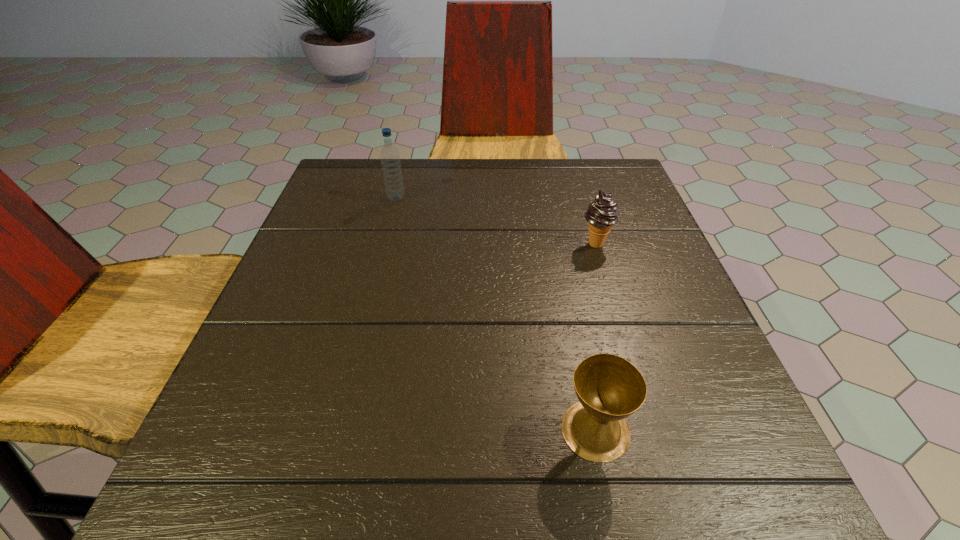
Where is `water bottle`? water bottle is located at coordinates (390, 158).

Image resolution: width=960 pixels, height=540 pixels. I want to click on the leftmost object, so click(390, 158).

Where is `icecream`? This screenshot has height=540, width=960. icecream is located at coordinates (601, 215).

Locate an element on the screen. chalice is located at coordinates (609, 388).

Locate an element on the screen. This screenshot has width=960, height=540. vacant space situated on the left of the farthest object is located at coordinates (367, 198).

Where is `vacant space situated 0.270m on the front of the icecream`? This screenshot has width=960, height=540. vacant space situated 0.270m on the front of the icecream is located at coordinates (631, 359).

Locate an element on the screen. This screenshot has height=540, width=960. vacant space located 0.120m on the back of the chalice is located at coordinates (577, 338).

Locate an element on the screen. This screenshot has height=540, width=960. object located at the far edge is located at coordinates (390, 158).

This screenshot has width=960, height=540. What are the coordinates of `object that is at the near edge` in the screenshot? It's located at (609, 388).

Find the location of a particular element. object that is at the left edge is located at coordinates (390, 158).